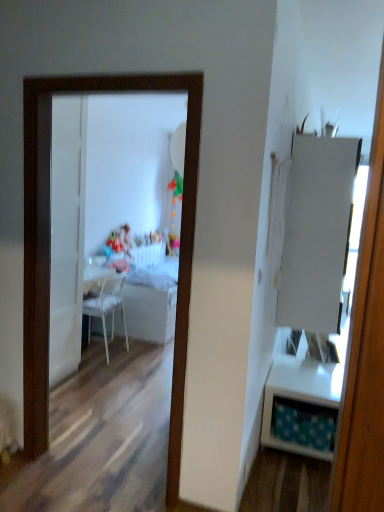
Question: In the image, is white glossy table at center, the second table from the front, on the left side or the right side of white glossy mirror at center?

Choices:
 (A) right
 (B) left

Answer: (A)

Question: In terms of size, does white glossy table at center, the 1th table positioned from the back, appear bigger or smaller than white glossy mirror at center?

Choices:
 (A) small
 (B) big

Answer: (B)

Question: Which object is the farthest from the white glossy table at center, the 2th table viewed from the right?

Choices:
 (A) white matte cabinet at right
 (B) white glossy table at right, positioned as the 2th table in left-to-right order
 (C) white glossy mirror at center
 (D) white plastic chair at center
 (E) white glossy door at center

Answer: (C)

Question: Which object is the farthest from the white plastic chair at center?

Choices:
 (A) white glossy door at center
 (B) white glossy table at center, the first table viewed from the left
 (C) white glossy table at right, positioned as the 2th table in left-to-right order
 (D) white glossy mirror at center
 (E) matte plastic toy at center

Answer: (C)